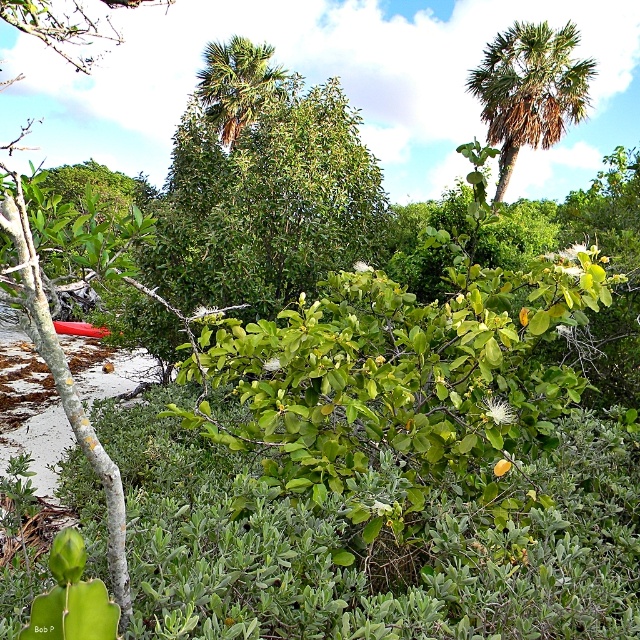
Is brown textured palm tree at upper right above green leafy palm tree at upper center?

No, brown textured palm tree at upper right is not above green leafy palm tree at upper center.

Who is more distant from viewer, (560, 52) or (198, 84)?

The point (560, 52) is more distant.

Is point (512, 172) closer to camera compared to point (234, 102)?

No, (512, 172) is further to viewer.

Where is `brown textured palm tree at upper right`? The image size is (640, 640). brown textured palm tree at upper right is located at coordinates (529, 90).

Does green leafy bush at center appear under brown textured palm tree at upper right?

Correct, green leafy bush at center is located below brown textured palm tree at upper right.

Identify the location of green leafy bush at center. (260, 188).

Does green leafy bush at center have a greater height compared to green leafy palm tree at upper center?

Yes, green leafy bush at center is taller than green leafy palm tree at upper center.

Is point (232, 170) positioned behind point (209, 67)?

No, (232, 170) is closer to viewer.

Describe the element at coordinates (260, 188) in the screenshot. This screenshot has width=640, height=640. I see `green leafy bush at center` at that location.

You are a GUI agent. You are given a task and a screenshot of the screen. Output one action in this format:
    pyautogui.click(x=<x>, y=<y>)
    Task: Click on the green leafy bush at center
    Image resolution: width=640 pixels, height=640 pixels.
    Given the screenshot: What is the action you would take?
    pyautogui.click(x=260, y=188)